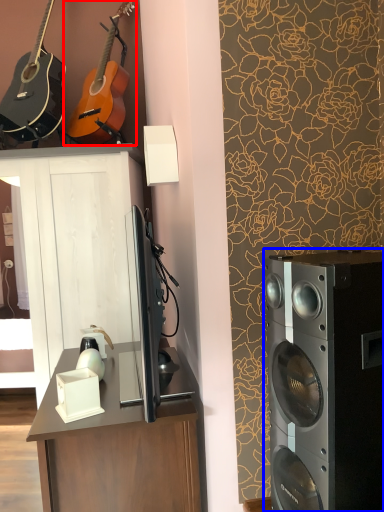
Question: Which of the following is the closest to the observer, guitar (highlighted by a red box) or home appliance (highlighted by a blue box)?

Choices:
 (A) guitar
 (B) home appliance

Answer: (B)